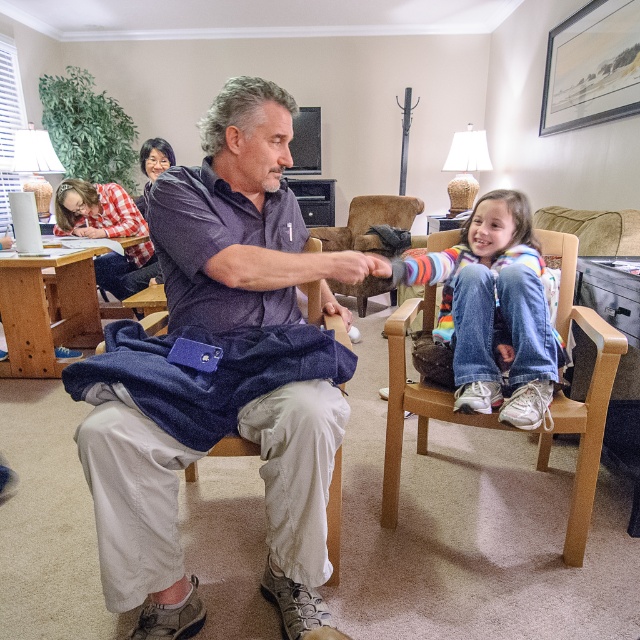
Can you confirm if matte blue shirt at center is positioned to the right of denim fabric at lower right?

In fact, matte blue shirt at center is to the left of denim fabric at lower right.

Find the location of `matte blue shirt at center`. matte blue shirt at center is located at coordinates (220, 374).

Which is behind, point (177, 218) or point (550, 436)?

Positioned behind is point (550, 436).

The width and height of the screenshot is (640, 640). I want to click on matte blue shirt at center, so click(220, 374).

Is denim fabric at lower right to the right of khaki fabric armchair at center from the viewer's perspective?

Yes, denim fabric at lower right is to the right of khaki fabric armchair at center.

Who is more distant from viewer, (604, 369) or (150, 326)?

The point (150, 326) is behind.

You are a GUI agent. You are given a task and a screenshot of the screen. Output one action in this format:
    pyautogui.click(x=<x>, y=<y>)
    Task: Click on the denim fabric at lower right
    The width and height of the screenshot is (640, 640).
    Given the screenshot: What is the action you would take?
    pyautogui.click(x=586, y=397)

Does jeans at lower right appear on the left side of khaki fabric armchair at center?

No, jeans at lower right is not to the left of khaki fabric armchair at center.

Is the position of jeans at lower right less distant than that of khaki fabric armchair at center?

No, jeans at lower right is behind khaki fabric armchair at center.

Where is `jeans at lower right`? jeans at lower right is located at coordinates (493, 310).

Image resolution: width=640 pixels, height=640 pixels. What are the coordinates of `jeans at lower right` in the screenshot? It's located at (493, 310).